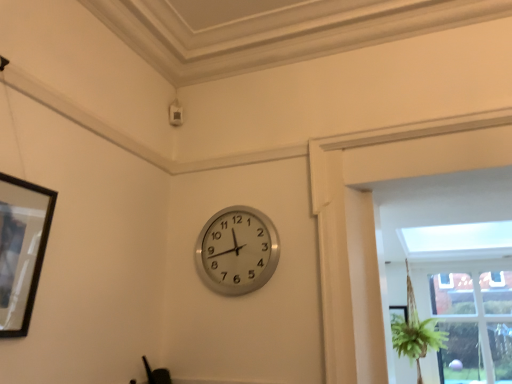
Question: Can you confirm if clear glass window at center right is shorter than black matte picture frame at left?

Choices:
 (A) yes
 (B) no

Answer: (B)

Question: Is black matte picture frame at left inside clear glass window at center right?

Choices:
 (A) yes
 (B) no

Answer: (B)

Question: From a real-world perspective, is clear glass window at center right below black matte picture frame at left?

Choices:
 (A) yes
 (B) no

Answer: (A)

Question: Considering the relative sizes of clear glass window at center right and black matte picture frame at left in the image provided, is clear glass window at center right thinner than black matte picture frame at left?

Choices:
 (A) no
 (B) yes

Answer: (A)

Question: Is clear glass window at center right to the left of black matte picture frame at left from the viewer's perspective?

Choices:
 (A) no
 (B) yes

Answer: (A)

Question: Considering the relative sizes of clear glass window at center right and black matte picture frame at left in the image provided, is clear glass window at center right taller than black matte picture frame at left?

Choices:
 (A) yes
 (B) no

Answer: (A)

Question: Is black matte picture frame at left taller than silver metallic clock at center?

Choices:
 (A) yes
 (B) no

Answer: (A)

Question: Is black matte picture frame at left facing away from silver metallic clock at center?

Choices:
 (A) no
 (B) yes

Answer: (A)

Question: Are black matte picture frame at left and silver metallic clock at center far apart?

Choices:
 (A) no
 (B) yes

Answer: (A)

Question: From a real-world perspective, is black matte picture frame at left physically above silver metallic clock at center?

Choices:
 (A) yes
 (B) no

Answer: (B)

Question: Can silver metallic clock at center be found inside black matte picture frame at left?

Choices:
 (A) no
 (B) yes

Answer: (A)

Question: From a real-world perspective, does black matte picture frame at left sit lower than silver metallic clock at center?

Choices:
 (A) no
 (B) yes

Answer: (B)

Question: From a real-world perspective, is silver metallic clock at center located higher than black matte picture frame at left?

Choices:
 (A) yes
 (B) no

Answer: (A)